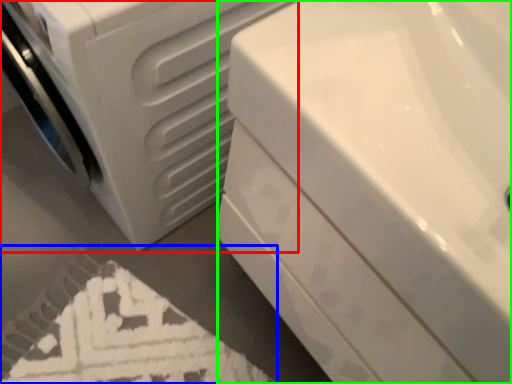
Question: Considering the real-world distances, which object is closest to washing machine (highlighted by a red box)? bath mat (highlighted by a blue box) or bath (highlighted by a green box).

Choices:
 (A) bath mat
 (B) bath

Answer: (B)